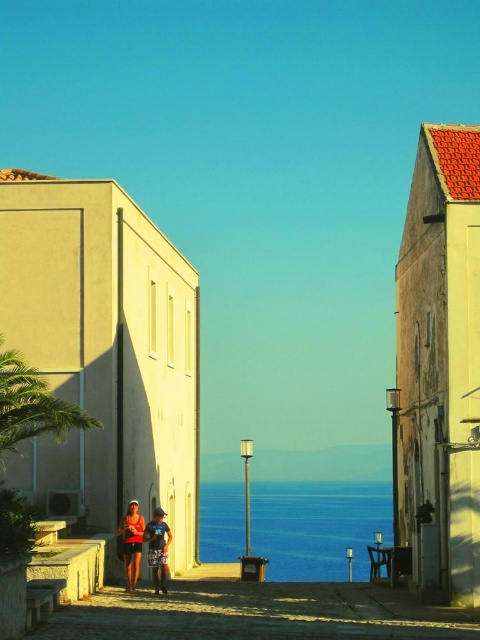
Question: Which object is the closest to the matte orange tank top at center?

Choices:
 (A) blue water at center
 (B) blue denim shorts at center
 (C) matte orange shorts at center

Answer: (C)

Question: Considering the relative positions of matte orange tank top at center and blue denim shorts at center in the image provided, where is matte orange tank top at center located with respect to blue denim shorts at center?

Choices:
 (A) left
 (B) right

Answer: (A)

Question: Can you confirm if matte orange shorts at center is bigger than blue denim shorts at center?

Choices:
 (A) yes
 (B) no

Answer: (A)

Question: Can you confirm if matte orange tank top at center is positioned below blue denim shorts at center?

Choices:
 (A) no
 (B) yes

Answer: (A)

Question: Which point is closer to the camera?

Choices:
 (A) blue denim shorts at center
 (B) matte orange shorts at center
 (C) matte orange tank top at center

Answer: (B)

Question: Which object is positioned closest to the blue denim shorts at center?

Choices:
 (A) blue water at center
 (B) matte orange shorts at center
 (C) matte orange tank top at center

Answer: (B)